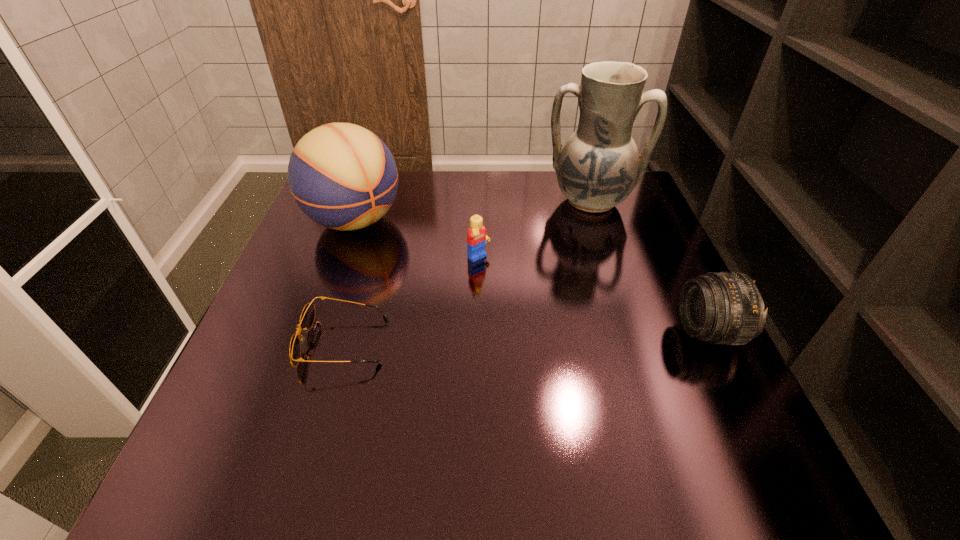
Find the location of a particular element. The width and height of the screenshot is (960, 540). basketball that is at the far edge is located at coordinates (342, 176).

What are the coordinates of `pitcher present at the far edge` in the screenshot? It's located at (598, 167).

This screenshot has width=960, height=540. In order to click on sunglasses located in the left edge section of the desktop in this screenshot , I will do `click(307, 316)`.

This screenshot has height=540, width=960. I want to click on basketball at the left edge, so click(x=342, y=176).

The image size is (960, 540). Find the location of `telephoto lens situated at the right edge`. telephoto lens situated at the right edge is located at coordinates (726, 308).

Where is `pitcher present at the right edge`? pitcher present at the right edge is located at coordinates (598, 167).

Image resolution: width=960 pixels, height=540 pixels. I want to click on object that is positioned at the far left corner, so click(x=342, y=176).

I want to click on object at the far right corner, so click(x=598, y=167).

This screenshot has width=960, height=540. In the image, there is a desktop. Find the location of `vacant space at the near edge`. vacant space at the near edge is located at coordinates (595, 416).

In the image, there is a desktop. Where is `vacant space at the left edge`? This screenshot has height=540, width=960. vacant space at the left edge is located at coordinates (358, 247).